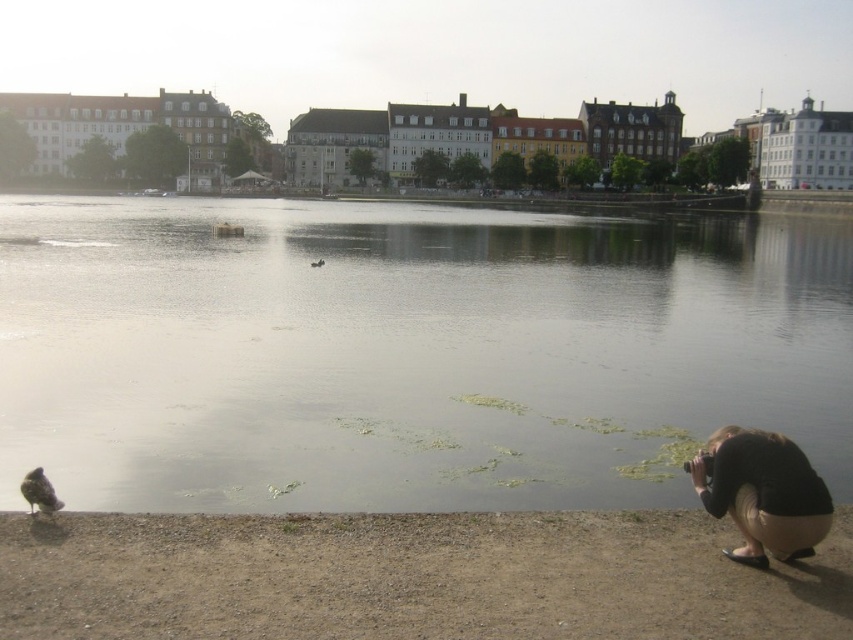
Question: Does black fabric squat at lower right have a smaller size compared to brown feathered bird at lower left?

Choices:
 (A) yes
 (B) no

Answer: (B)

Question: Which object is the closest to the brown feathered bird at center?

Choices:
 (A) clear water at center
 (B) brown feathered bird at lower left

Answer: (A)

Question: Which of these objects is positioned closest to the black fabric squat at lower right?

Choices:
 (A) clear water at center
 (B) brown feathered bird at lower left
 (C) brown feathered bird at center

Answer: (A)

Question: Does clear water at center have a greater width compared to black fabric squat at lower right?

Choices:
 (A) no
 (B) yes

Answer: (B)

Question: Can you confirm if black fabric squat at lower right is positioned to the right of brown feathered bird at lower left?

Choices:
 (A) yes
 (B) no

Answer: (A)

Question: Which point is closer to the camera taking this photo?

Choices:
 (A) (317, 262)
 (B) (254, 509)

Answer: (B)